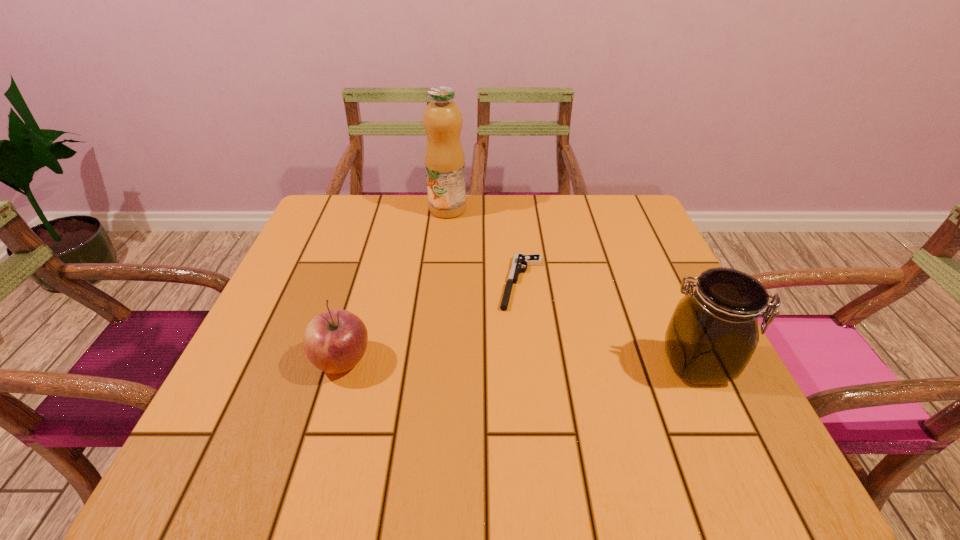
This screenshot has width=960, height=540. Identify the location of vacant region between the second tallest object and the pistol. (609, 323).

Where is `free space between the tallest object and the rightmost object`? The image size is (960, 540). free space between the tallest object and the rightmost object is located at coordinates (572, 287).

I want to click on vacant region between the apple and the fruit juice, so click(395, 285).

The image size is (960, 540). What are the coordinates of `vacant area between the apple and the fruit juice` in the screenshot? It's located at (395, 285).

The height and width of the screenshot is (540, 960). In order to click on vacant area that lies between the apple and the fruit juice in this screenshot , I will do `click(395, 285)`.

This screenshot has width=960, height=540. Identify the location of free space between the apple and the shortest object. (432, 322).

The width and height of the screenshot is (960, 540). In order to click on unoccupied position between the second object from left to right and the leftmost object in this screenshot , I will do `click(395, 285)`.

This screenshot has width=960, height=540. Identify the location of vacant region between the leftmost object and the tallest object. (395, 285).

Select which object is the closest to the fruit juice. Please provide its 2D coordinates. Your answer should be formatted as a tuple, i.e. [(x, y)], where the tuple contains the x and y coordinates of a point satisfying the conditions above.

[(519, 260)]

The width and height of the screenshot is (960, 540). What are the coordinates of `object that is the second nearest to the third object from left to right` in the screenshot? It's located at (713, 333).